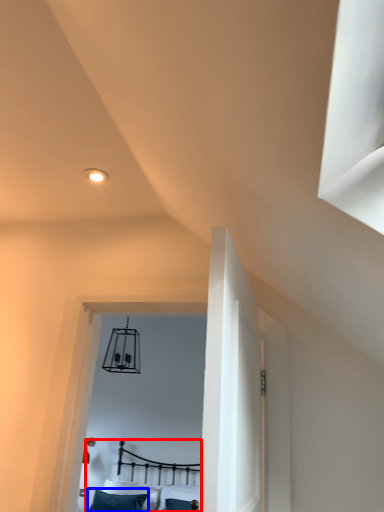
Question: Among these objects, which one is farthest to the camera, bed (highlighted by a red box) or pillow (highlighted by a blue box)?

Choices:
 (A) bed
 (B) pillow

Answer: (B)